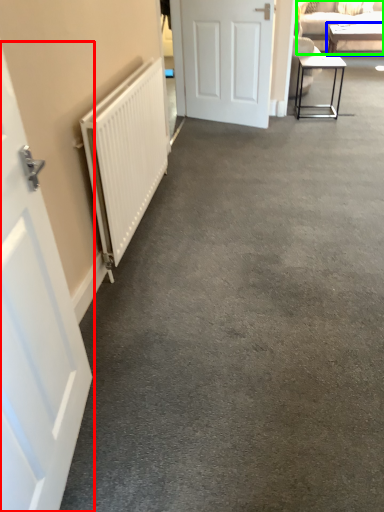
Question: Which object is the closest to the door (highlighted by a red box)? Choose among these: table (highlighted by a blue box) or studio couch (highlighted by a green box).

Choices:
 (A) table
 (B) studio couch

Answer: (B)